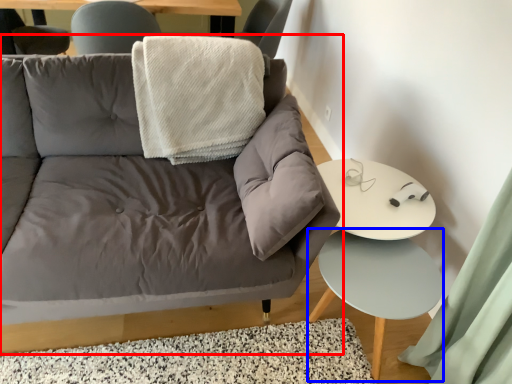
Question: Which object is closer to the camera taking this photo, studio couch (highlighted by a red box) or side table (highlighted by a blue box)?

Choices:
 (A) studio couch
 (B) side table

Answer: (A)